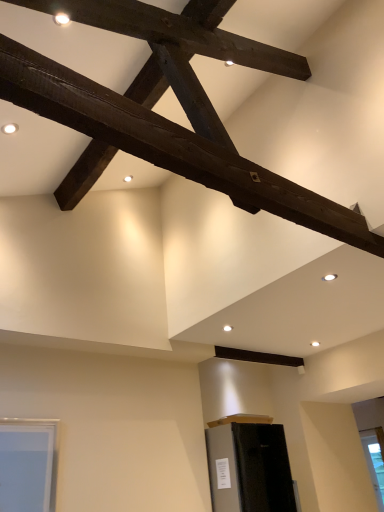
Locate an element on the screen. clear glass window at lower right is located at coordinates (374, 463).

This screenshot has height=512, width=384. What do you see at coordinates (374, 463) in the screenshot?
I see `clear glass window at lower right` at bounding box center [374, 463].

Describe the element at coordinates (249, 468) in the screenshot. I see `matte black refrigerator at lower center` at that location.

You are a GUI agent. You are given a task and a screenshot of the screen. Output one action in this format:
    pyautogui.click(x=<x>, y=<y>)
    Task: Click on the clear glass window at lower right
    The height and width of the screenshot is (512, 384).
    Given the screenshot: What is the action you would take?
    point(374,463)

Does point (171, 160) lie behind point (287, 454)?

No, it is not.

Is dark brown wood beam at upper center at the right side of matte black refrigerator at lower center?

No.

In the scene shown: Which of these two, dark brown wood beam at upper center or matte black refrigerator at lower center, stands taller?

matte black refrigerator at lower center is taller.

Considering the relative sizes of dark brown wood beam at upper center and matte black refrigerator at lower center in the image provided, is dark brown wood beam at upper center bigger than matte black refrigerator at lower center?

Actually, dark brown wood beam at upper center might be smaller than matte black refrigerator at lower center.

Who is more distant, matte black refrigerator at lower center or dark brown wood beam at upper center?

Positioned behind is matte black refrigerator at lower center.

Could you tell me if matte black refrigerator at lower center is facing dark brown wood beam at upper center?

No.

Considering the sizes of matte black refrigerator at lower center and dark brown wood beam at upper center in the image, is matte black refrigerator at lower center bigger or smaller than dark brown wood beam at upper center?

In the image, matte black refrigerator at lower center appears to be larger than dark brown wood beam at upper center.

From the image's perspective, which is below, matte black refrigerator at lower center or dark brown wood beam at upper center?

matte black refrigerator at lower center appears lower in the image.

From a real-world perspective, is clear glass window at lower right below dark brown wood beam at upper center?

Yes.

Is clear glass window at lower right facing away from dark brown wood beam at upper center?

No.

Is clear glass window at lower right wider than dark brown wood beam at upper center?

Incorrect, the width of clear glass window at lower right does not surpass that of dark brown wood beam at upper center.

From the picture: Do you think clear glass window at lower right is within dark brown wood beam at upper center, or outside of it?

clear glass window at lower right is spatially situated outside dark brown wood beam at upper center.

Is dark brown wood beam at upper center located outside clear glass window at lower right?

Indeed, dark brown wood beam at upper center is completely outside clear glass window at lower right.

Considering the positions of point (265, 203) and point (374, 437), is point (265, 203) closer or farther from the camera than point (374, 437)?

Point (265, 203).

Which of these two, dark brown wood beam at upper center or clear glass window at lower right, stands taller?

Standing taller between the two is clear glass window at lower right.

Is dark brown wood beam at upper center with clear glass window at lower right?

No, dark brown wood beam at upper center is not touching clear glass window at lower right.

From the picture: Is clear glass window at lower right outside of matte black refrigerator at lower center?

Yes.

Does clear glass window at lower right come behind matte black refrigerator at lower center?

Yes, the depth of clear glass window at lower right is greater than that of matte black refrigerator at lower center.

Is clear glass window at lower right touching matte black refrigerator at lower center?

They are not placed beside each other.

Is point (222, 481) positioned behind point (380, 468)?

No, it is in front of (380, 468).

Is matte black refrigerator at lower center wider or thinner than clear glass window at lower right?

Clearly, matte black refrigerator at lower center has more width compared to clear glass window at lower right.

Locate an element on the screen. The image size is (384, 512). furniture on the left of clear glass window at lower right is located at coordinates (249, 468).

Can you tell me how much matte black refrigerator at lower center and clear glass window at lower right differ in facing direction?

The facing directions of matte black refrigerator at lower center and clear glass window at lower right are 91.1 degrees apart.

Identify the location of beam to the left of matte black refrigerator at lower center. (168, 144).

The width and height of the screenshot is (384, 512). What are the coordinates of `beam that appears above the matte black refrigerator at lower center (from the image's perspective)` in the screenshot? It's located at (168, 144).

Estimate the real-world distances between objects in this image. Which object is closer to clear glass window at lower right, dark brown wood beam at upper center or matte black refrigerator at lower center?

matte black refrigerator at lower center is closer to clear glass window at lower right.

Estimate the real-world distances between objects in this image. Which object is further from matte black refrigerator at lower center, dark brown wood beam at upper center or clear glass window at lower right?

dark brown wood beam at upper center is positioned further to the anchor matte black refrigerator at lower center.

Consider the image. From the image, which object appears to be farther from clear glass window at lower right, matte black refrigerator at lower center or dark brown wood beam at upper center?

dark brown wood beam at upper center is further to clear glass window at lower right.

Looking at the image, which one is located further to dark brown wood beam at upper center, clear glass window at lower right or matte black refrigerator at lower center?

Among the two, clear glass window at lower right is located further to dark brown wood beam at upper center.

When comparing their distances from dark brown wood beam at upper center, does matte black refrigerator at lower center or clear glass window at lower right seem closer?

matte black refrigerator at lower center lies closer to dark brown wood beam at upper center than the other object.

When comparing their distances from matte black refrigerator at lower center, does clear glass window at lower right or dark brown wood beam at upper center seem closer?

clear glass window at lower right lies closer to matte black refrigerator at lower center than the other object.

Where is `furniture located between dark brown wood beam at upper center and clear glass window at lower right in the depth direction`? This screenshot has height=512, width=384. furniture located between dark brown wood beam at upper center and clear glass window at lower right in the depth direction is located at coordinates (249, 468).